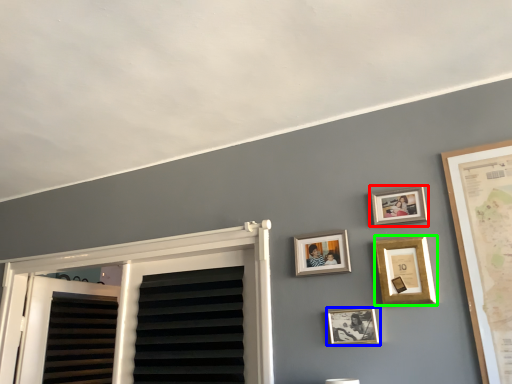
Question: Which object is positioned farthest from picture frame (highlighted by a red box)? Select from picture frame (highlighted by a blue box) and picture frame (highlighted by a green box).

Choices:
 (A) picture frame
 (B) picture frame

Answer: (A)